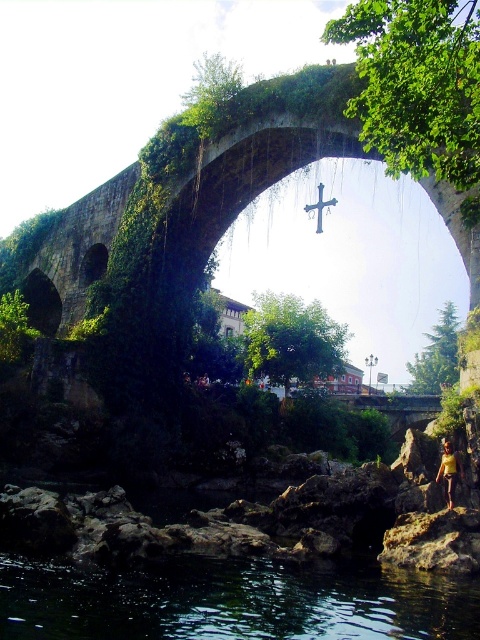
You are standing on the ancient stone arch bridge and see the transparent dark water at lower center and the yellow fabric person at lower right. Which object is closer to your right side?

The yellow fabric person at lower right is closer to your right side because it is positioned on the right side of the transparent dark water at lower center.

You are standing at the center of the ancient stone arch bridge and want to cross to the other side. There is transparent dark water at lower center. Where exactly is the transparent dark water located relative to your position?

The transparent dark water at lower center is located at point 0.944 on the x axis and 0.483 on the y axis relative to your position.

You are standing on the ancient stone arch bridge and notice the transparent dark water at lower center and the yellow fabric person at lower right. Which object is wider in this scene?

The transparent dark water at lower center is wider than the yellow fabric person at lower right.